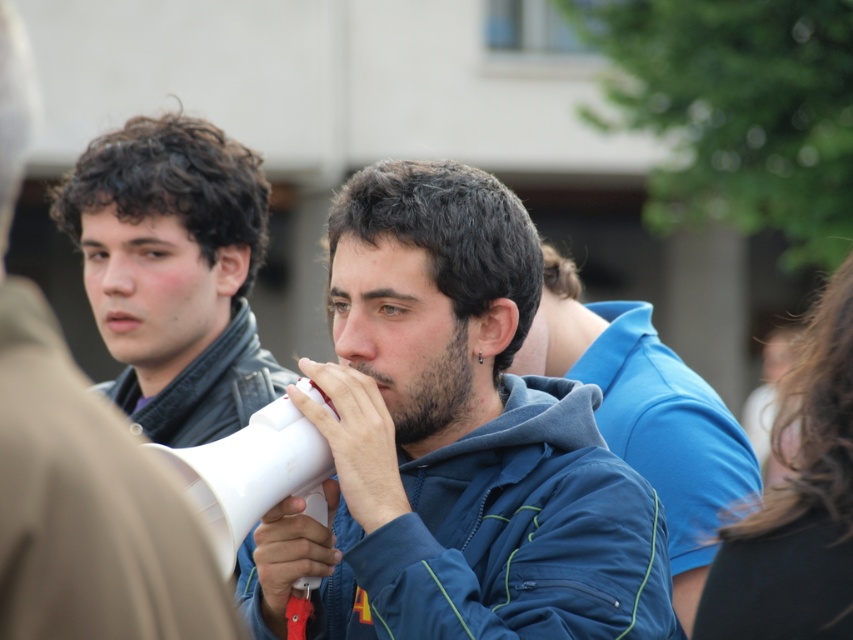
Question: Does matte black jacket at left have a lesser width compared to blue fabric shirt at center?

Choices:
 (A) no
 (B) yes

Answer: (B)

Question: Considering the real-world distances, which object is farthest from the blue fabric shirt at center?

Choices:
 (A) white plastic megaphone at center
 (B) matte black jacket at left

Answer: (B)

Question: Is blue fleece jacket at center thinner than matte black jacket at left?

Choices:
 (A) no
 (B) yes

Answer: (A)

Question: Which point is farther to the camera?

Choices:
 (A) white plastic megaphone at center
 (B) blue fabric shirt at center
 (C) blue fleece jacket at center

Answer: (B)

Question: Which of these objects is positioned closest to the blue fleece jacket at center?

Choices:
 (A) matte black jacket at left
 (B) blue fabric shirt at center

Answer: (B)

Question: Is blue fleece jacket at center in front of matte black jacket at left?

Choices:
 (A) no
 (B) yes

Answer: (A)